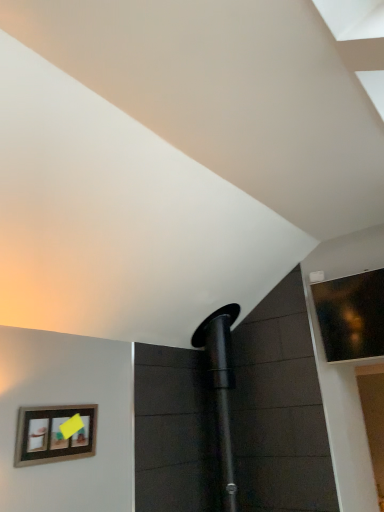
This screenshot has width=384, height=512. What do you see at coordinates (55, 434) in the screenshot?
I see `wooden picture frame at lower left` at bounding box center [55, 434].

Locate an element on the screen. wooden picture frame at lower left is located at coordinates (55, 434).

Identify the location of wooden picture frame at lower left. (55, 434).